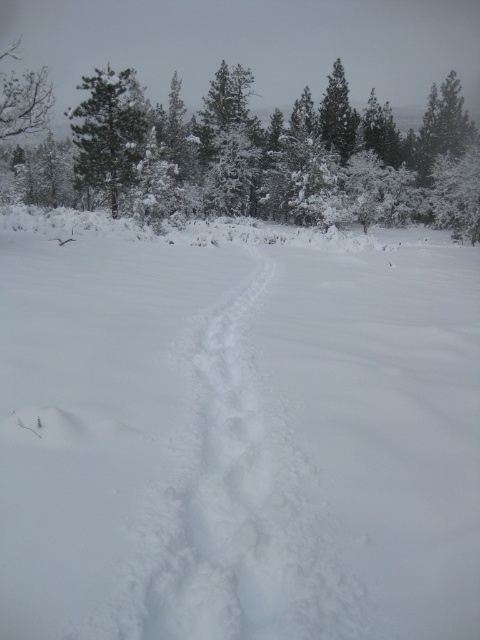
Question: Which of the following is the farthest from the observer?

Choices:
 (A) (73, 129)
 (B) (180, 116)
 (C) (156, 600)

Answer: (B)

Question: Is white fluffy snow at center below snow-covered evergreen tree at upper center?

Choices:
 (A) yes
 (B) no

Answer: (A)

Question: Does snow-covered evergreen tree at upper center appear over green matte tree at upper left?

Choices:
 (A) no
 (B) yes

Answer: (A)

Question: Is snow-covered evergreen tree at upper center closer to the viewer compared to white fluffy snow trail at center?

Choices:
 (A) yes
 (B) no

Answer: (B)

Question: Which object is closer to the camera taking this photo?

Choices:
 (A) green matte tree at upper left
 (B) white fluffy snow at center

Answer: (B)

Question: Estimate the real-world distances between objects in this image. Which object is farther from the white fluffy snow at center?

Choices:
 (A) white fluffy snow trail at center
 (B) green matte tree at upper left
 (C) snow-covered evergreen tree at upper center

Answer: (C)